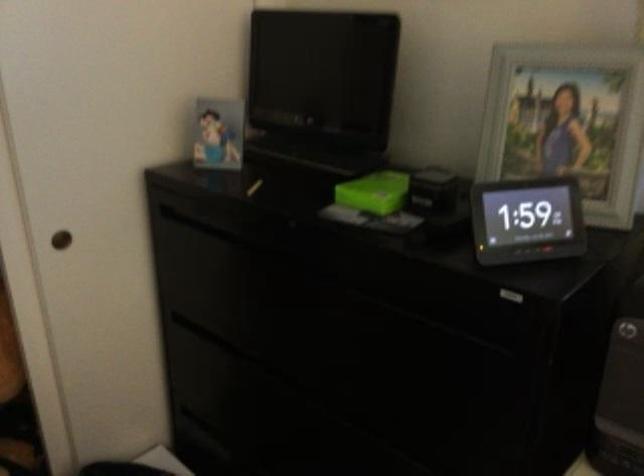
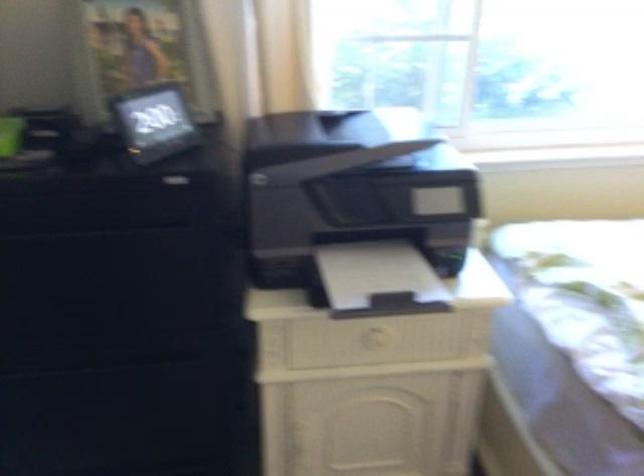
Locate, in the second image, the point that corresponds to point (520, 220) in the first image.

(154, 122)